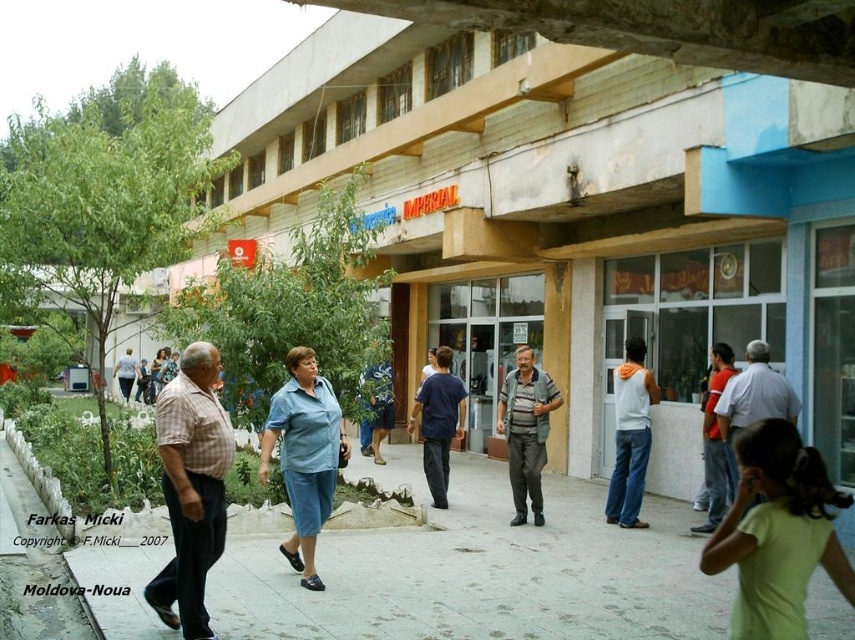
Is light green fabric at lower right closer to camera compared to light blue denim pants at center?

Yes, it is.

Does light green fabric at lower right have a larger size compared to light blue denim pants at center?

Actually, light green fabric at lower right might be smaller than light blue denim pants at center.

Does point (848, 586) come behind point (133, 358)?

That is False.

Find the location of a particular element. light green fabric at lower right is located at coordinates (777, 532).

Is point (221, 499) positioned after point (726, 468)?

No, (221, 499) is closer to viewer.

You are a GUI agent. You are given a task and a screenshot of the screen. Output one action in this format:
    pyautogui.click(x=<x>, y=<y>)
    Task: Click on the plaid cotton shirt at center
    
    Given the screenshot: What is the action you would take?
    pyautogui.click(x=192, y=486)

Find the location of a particular element. The height and width of the screenshot is (640, 855). plaid cotton shirt at center is located at coordinates (192, 486).

Does gray concrete pavement at center lie behind blue cotton shirt at center?

Yes, it is.

Is gray concrete pavement at center to the left of blue cotton shirt at center from the viewer's perspective?

Incorrect, gray concrete pavement at center is not on the left side of blue cotton shirt at center.

Between point (385, 600) and point (333, 420), which one is positioned in front?

Point (385, 600) is more forward.

Where is `gray concrete pavement at center`? gray concrete pavement at center is located at coordinates (472, 572).